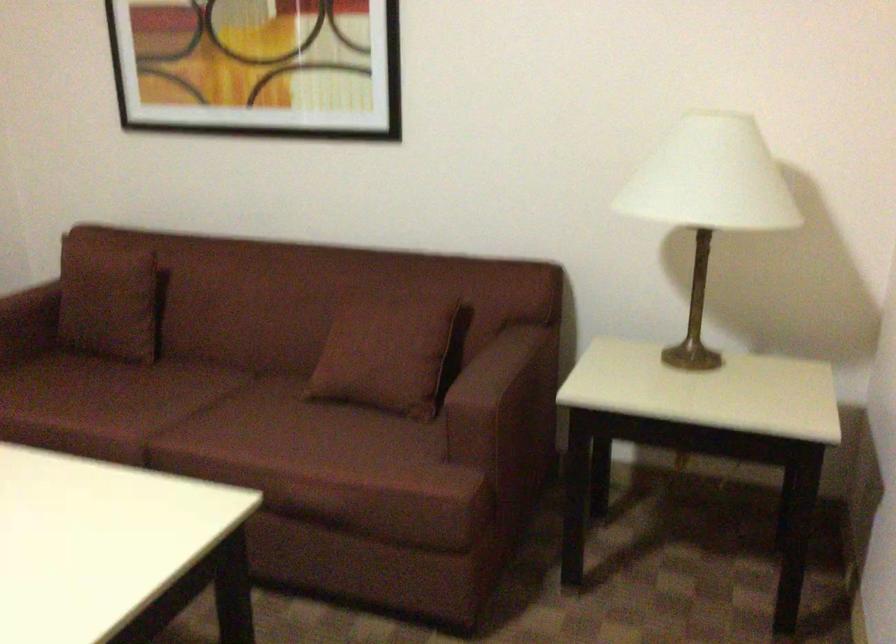
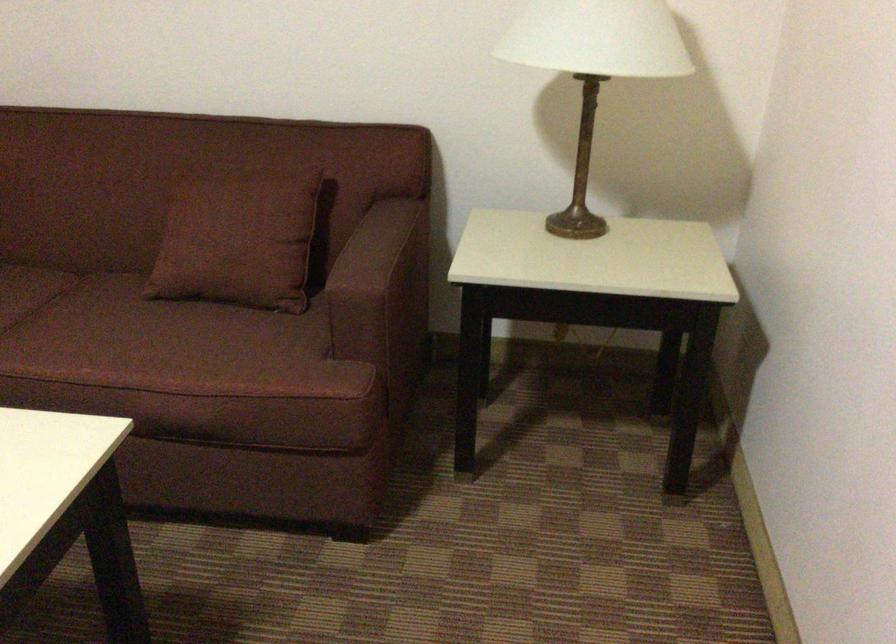
Where in the second image is the point corresponding to point (488, 373) from the first image?

(367, 254)